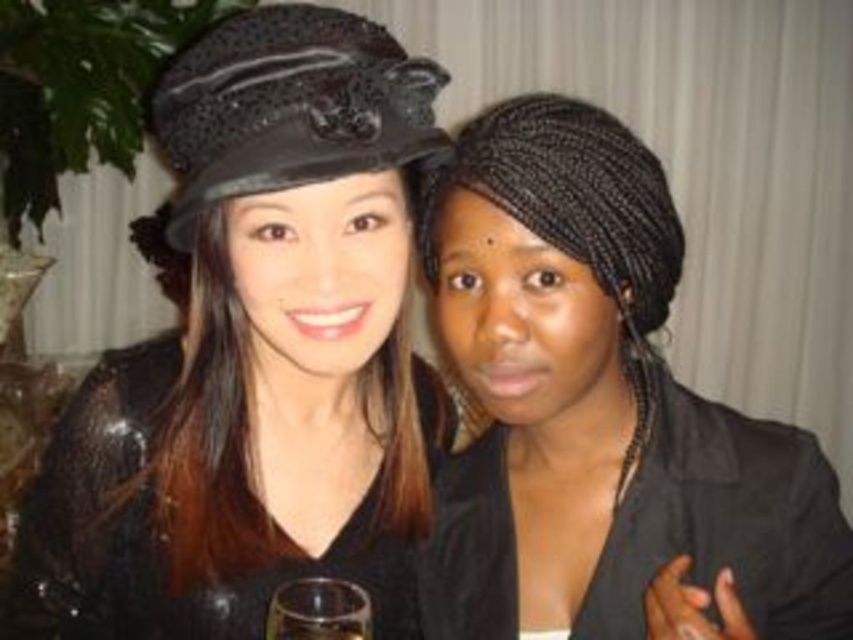
Is matte black hat at upper left thinner than black braided hair at center?

In fact, matte black hat at upper left might be wider than black braided hair at center.

Identify the location of matte black hat at upper left. The width and height of the screenshot is (853, 640). (254, 353).

Measure the distance from black braided hair at center to transparent glass at center.

A distance of 9.33 inches exists between black braided hair at center and transparent glass at center.

You are a GUI agent. You are given a task and a screenshot of the screen. Output one action in this format:
    pyautogui.click(x=<x>, y=<y>)
    Task: Click on the black braided hair at center
    The height and width of the screenshot is (640, 853).
    Given the screenshot: What is the action you would take?
    pyautogui.click(x=601, y=413)

Who is positioned more to the right, matte black hat at upper left or transparent glass at center?

transparent glass at center

Is matte black hat at upper left wider than transparent glass at center?

Indeed, matte black hat at upper left has a greater width compared to transparent glass at center.

Locate an element on the screen. The image size is (853, 640). matte black hat at upper left is located at coordinates (254, 353).